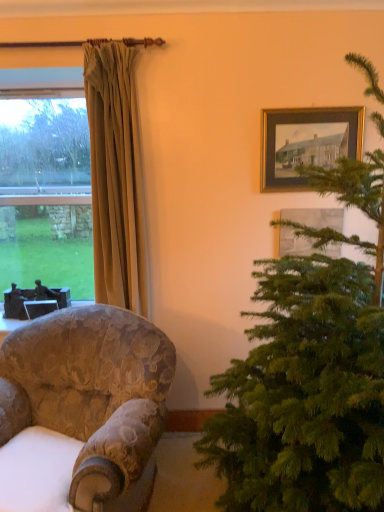
Question: Is metallic silver picture frame at upper left, marked as the 1th picture frame in a left-to-right arrangement, a part of green needle-like at right?

Choices:
 (A) yes
 (B) no

Answer: (B)

Question: From the image's perspective, is green needle-like at right beneath metallic silver picture frame at upper left, the 3th picture frame in the front-to-back sequence?

Choices:
 (A) no
 (B) yes

Answer: (A)

Question: Can you confirm if green needle-like at right is positioned to the left of metallic silver picture frame at upper left, the 1th picture frame ordered from the bottom?

Choices:
 (A) no
 (B) yes

Answer: (A)

Question: Is green needle-like at right not close to metallic silver picture frame at upper left, marked as the 1th picture frame in a left-to-right arrangement?

Choices:
 (A) yes
 (B) no

Answer: (A)

Question: From a real-world perspective, is green needle-like at right over metallic silver picture frame at upper left, the 1th picture frame ordered from the bottom?

Choices:
 (A) no
 (B) yes

Answer: (B)

Question: In terms of width, does green needle-like at right look wider or thinner when compared to wooden framed picture at upper right, positioned as the second picture frame in front-to-back order?

Choices:
 (A) wide
 (B) thin

Answer: (A)

Question: Visually, is green needle-like at right positioned to the left or to the right of wooden framed picture at upper right, which is the third picture frame in left-to-right order?

Choices:
 (A) right
 (B) left

Answer: (B)

Question: Considering their positions, is green needle-like at right located in front of or behind wooden framed picture at upper right, which is the third picture frame in left-to-right order?

Choices:
 (A) behind
 (B) front

Answer: (B)

Question: Is green needle-like at right taller or shorter than wooden framed picture at upper right, the 2th picture frame in the top-to-bottom sequence?

Choices:
 (A) tall
 (B) short

Answer: (A)

Question: Based on their positions, is gold-framed picture at upper right, positioned as the first picture frame in top-to-bottom order, located to the left or right of beige fabric curtain at left?

Choices:
 (A) right
 (B) left

Answer: (A)

Question: Considering the positions of gold-framed picture at upper right, which ranks as the 3th picture frame in back-to-front order, and beige fabric curtain at left in the image, is gold-framed picture at upper right, which ranks as the 3th picture frame in back-to-front order, taller or shorter than beige fabric curtain at left?

Choices:
 (A) tall
 (B) short

Answer: (B)

Question: From a real-world perspective, is gold-framed picture at upper right, which is the first picture frame from front to back, above or below beige fabric curtain at left?

Choices:
 (A) above
 (B) below

Answer: (A)

Question: Does point (264, 181) appear closer or farther from the camera than point (94, 53)?

Choices:
 (A) closer
 (B) farther

Answer: (B)

Question: Would you say clear glass window at left is inside or outside wooden framed picture at upper right, the 1th picture frame from the right?

Choices:
 (A) inside
 (B) outside

Answer: (B)

Question: Considering their positions, is clear glass window at left located in front of or behind wooden framed picture at upper right, which is the third picture frame in left-to-right order?

Choices:
 (A) front
 (B) behind

Answer: (B)